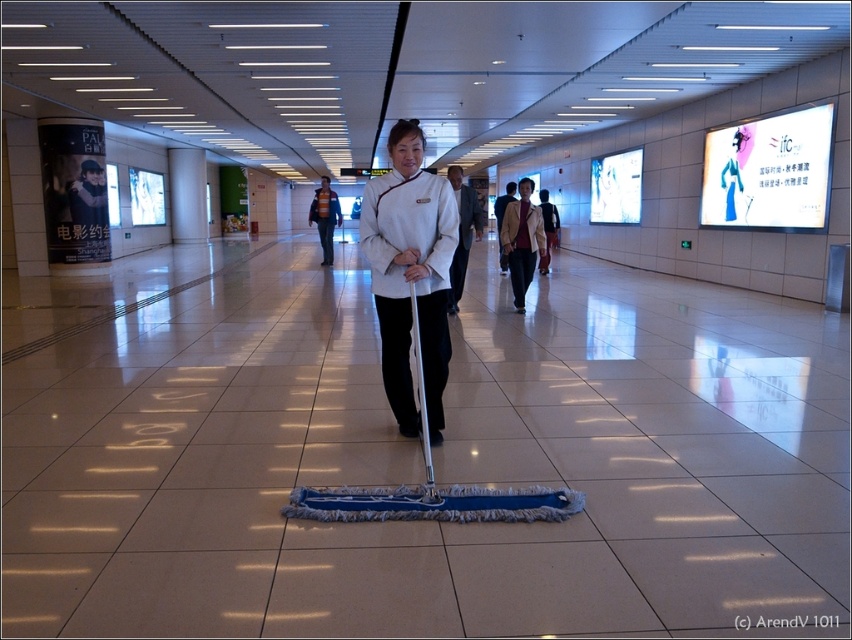
You are a delivery person carrying a package and need to pass through the corridor. There is a white fabric coat at center and a dark brown leather jacket at center. What is the minimum distance you need to maintain between these two items to avoid touching them while moving through the corridor?

The minimum distance you need to maintain between the white fabric coat at center and the dark brown leather jacket at center is 5.44 meters to avoid touching them while moving through the corridor.

You are a security guard patrolling the corridor and notice two coats hanging on a rack at the center. The coats are the white fabric coat at center and the dark brown leather jacket at center. Which coat is closer to the entrance of the corridor?

The white fabric coat at center is closer to the entrance because it is in front of the dark brown leather jacket at center, indicating it is positioned nearer to the entrance direction.

You are a maintenance supervisor inspecting the cleaning staff. You notice two items on the worker at center. Which item has a greater width between the white matte uniform at center and the white fabric coat at center?

The white matte uniform at center has a greater width than the white fabric coat at center.